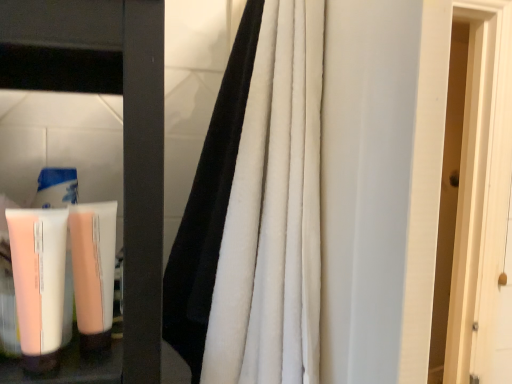
Question: Visually, is pink matte tube at lower left positioned to the left or to the right of pale pink matte tube at lower left?

Choices:
 (A) right
 (B) left

Answer: (B)

Question: Looking at the image, does pink matte tube at lower left seem bigger or smaller compared to pale pink matte tube at lower left?

Choices:
 (A) small
 (B) big

Answer: (B)

Question: Which of these objects is positioned farthest from the black velvet curtain at center?

Choices:
 (A) pale pink matte tube at lower left
 (B) pink matte tube at lower left

Answer: (B)

Question: Based on their relative distances, which object is farther from the pink matte tube at lower left?

Choices:
 (A) pale pink matte tube at lower left
 (B) black velvet curtain at center

Answer: (B)